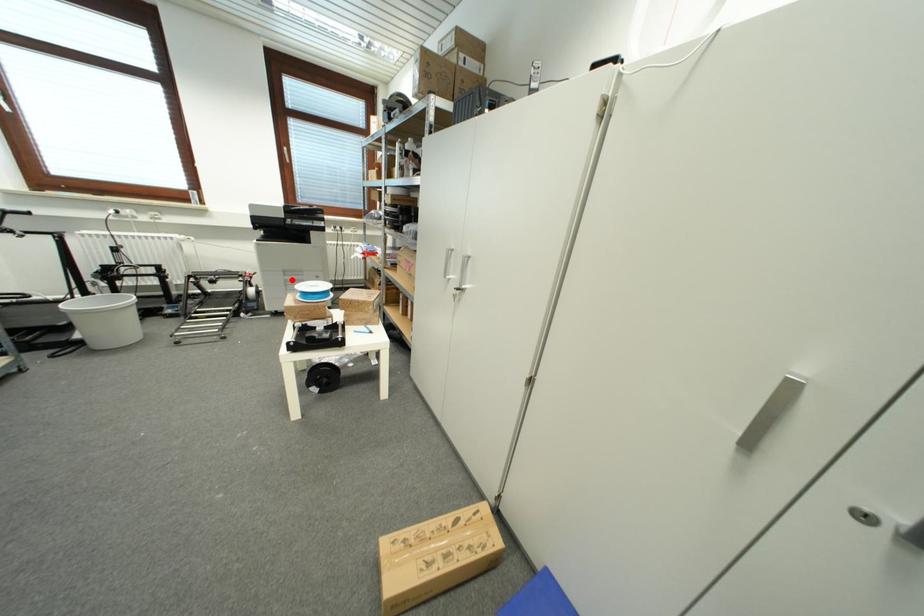
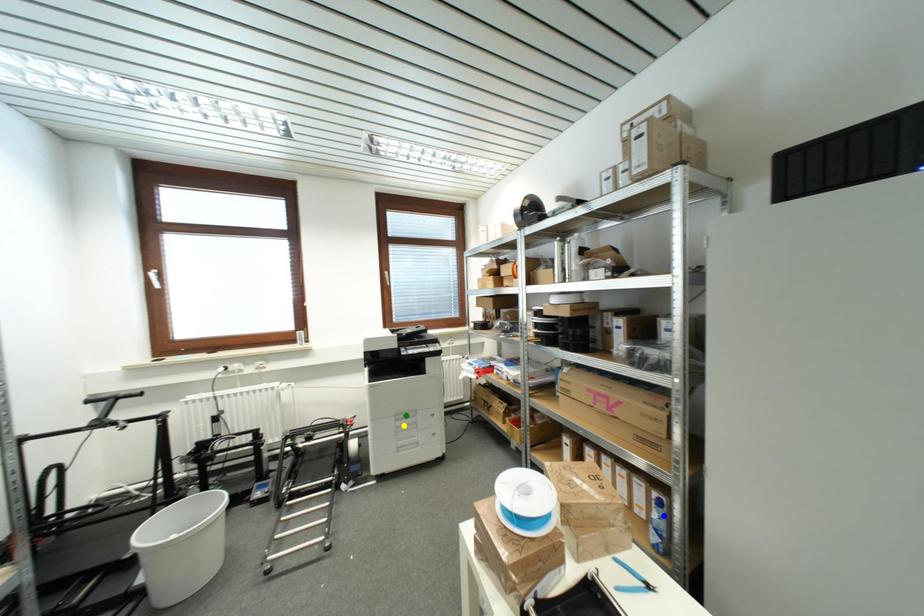
Question: I am providing you with two images of the same scene from different viewpoints. A red point is marked on the first image. You are given multiple points on the second image. Which point in image 2 represents the same 3d spot as the red point in image 1?

Choices:
 (A) blue point
 (B) green point
 (C) yellow point

Answer: (C)